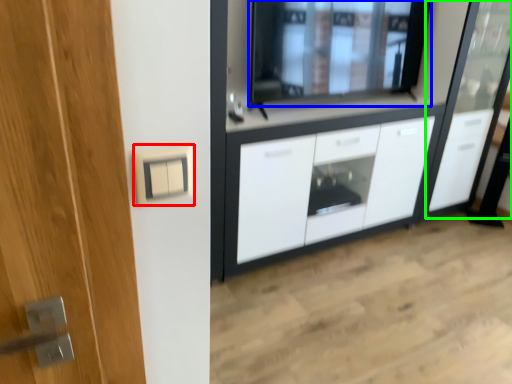
Question: Based on their relative distances, which object is nearer to electric outlet (highlighted by a red box)? Choose from window (highlighted by a blue box) and screen door (highlighted by a green box).

Choices:
 (A) window
 (B) screen door

Answer: (A)